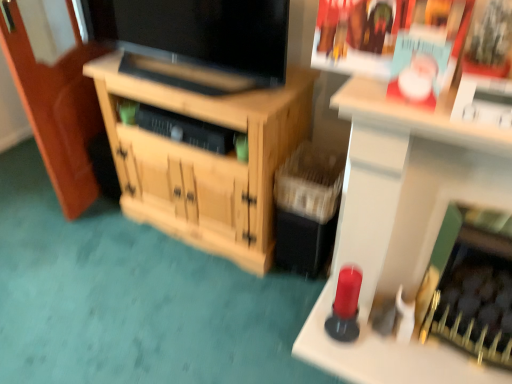
What do you see at coordinates (418, 70) in the screenshot? The image size is (512, 384). I see `matte paper magazine at upper right` at bounding box center [418, 70].

The height and width of the screenshot is (384, 512). What are the coordinates of `wooden cabinet at center` in the screenshot? It's located at (205, 160).

Which is more to the left, wooden cabinet at center or matte black tv at center?

From the viewer's perspective, matte black tv at center appears more on the left side.

Is wooden cabinet at center far away from matte black tv at center?

No.

From a real-world perspective, which is physically above, wooden cabinet at center or matte black tv at center?

matte black tv at center.

Is wooden cabinet at center positioned with its back to matte black tv at center?

wooden cabinet at center does not have its back to matte black tv at center.

Considering the positions of objects wooden cabinet at center and matte paper magazine at upper right in the image provided, who is behind, wooden cabinet at center or matte paper magazine at upper right?

wooden cabinet at center is more distant.

From the image's perspective, relative to matte paper magazine at upper right, is wooden cabinet at center above or below?

wooden cabinet at center is situated lower than matte paper magazine at upper right in the image.

Between wooden cabinet at center and matte paper magazine at upper right, which one appears on the right side from the viewer's perspective?

Positioned to the right is matte paper magazine at upper right.

Looking at this image, which of these two, wooden cabinet at center or matte paper magazine at upper right, is smaller?

With smaller size is matte paper magazine at upper right.

Who is more distant, matte black tv at center or matte paper magazine at upper right?

matte black tv at center is behind.

Looking at this image, from a real-world perspective, is matte black tv at center on matte paper magazine at upper right?

Actually, matte black tv at center is physically below matte paper magazine at upper right in the real world.

Looking at this image, how far apart are matte black tv at center and matte paper magazine at upper right?

matte black tv at center is 28.54 inches from matte paper magazine at upper right.

Between matte black tv at center and matte paper magazine at upper right, which one has larger width?

With larger width is matte black tv at center.

Based on their positions, is matte paper magazine at upper right located to the left or right of wooden cabinet at center?

Clearly, matte paper magazine at upper right is on the right of wooden cabinet at center in the image.

From a real-world perspective, which is physically below, matte paper magazine at upper right or wooden cabinet at center?

wooden cabinet at center.

Consider the image. From the image's perspective, would you say matte paper magazine at upper right is positioned over wooden cabinet at center?

Yes, from the image's perspective, matte paper magazine at upper right is over wooden cabinet at center.

Is matte paper magazine at upper right situated inside wooden cabinet at center or outside?

matte paper magazine at upper right cannot be found inside wooden cabinet at center.

Could you tell me if matte paper magazine at upper right is turned towards matte black tv at center?

No, matte paper magazine at upper right is not aimed at matte black tv at center.

Does matte paper magazine at upper right have a smaller size compared to matte black tv at center?

Yes.

Is matte paper magazine at upper right at the left side of matte black tv at center?

Incorrect, matte paper magazine at upper right is not on the left side of matte black tv at center.

Consider the image. How much distance is there between matte black tv at center and wooden cabinet at center?

matte black tv at center and wooden cabinet at center are 10.68 inches apart from each other.

Is matte black tv at center at the right side of wooden cabinet at center?

No, matte black tv at center is not to the right of wooden cabinet at center.

Is matte black tv at center thinner than wooden cabinet at center?

Indeed, matte black tv at center has a lesser width compared to wooden cabinet at center.

Is matte black tv at center placed right next to wooden cabinet at center?

matte black tv at center and wooden cabinet at center are clearly separated.

Where is `cabinetry below the matte black tv at center (from a real-world perspective)`? The image size is (512, 384). cabinetry below the matte black tv at center (from a real-world perspective) is located at coordinates (205, 160).

Image resolution: width=512 pixels, height=384 pixels. Find the location of `cabinetry below the matte paper magazine at upper right (from the image's perspective)`. cabinetry below the matte paper magazine at upper right (from the image's perspective) is located at coordinates 205,160.

Based on their spatial positions, is wooden cabinet at center or matte black tv at center closer to matte paper magazine at upper right?

The object closer to matte paper magazine at upper right is matte black tv at center.

Looking at the image, which one is located further to matte black tv at center, wooden cabinet at center or matte paper magazine at upper right?

Among the two, matte paper magazine at upper right is located further to matte black tv at center.

Considering their positions, is matte black tv at center positioned closer to matte paper magazine at upper right than wooden cabinet at center?

Among the two, matte black tv at center is located nearer to matte paper magazine at upper right.

Looking at the image, which one is located closer to wooden cabinet at center, matte paper magazine at upper right or matte black tv at center?

matte black tv at center is positioned closer to the anchor wooden cabinet at center.

Estimate the real-world distances between objects in this image. Which object is closer to matte black tv at center, matte paper magazine at upper right or wooden cabinet at center?

Among the two, wooden cabinet at center is located nearer to matte black tv at center.

In the scene shown: Based on their spatial positions, is matte black tv at center or matte paper magazine at upper right closer to wooden cabinet at center?

matte black tv at center.

Where is `cabinetry between matte black tv at center and matte paper magazine at upper right in the horizontal direction`? Image resolution: width=512 pixels, height=384 pixels. cabinetry between matte black tv at center and matte paper magazine at upper right in the horizontal direction is located at coordinates (205, 160).